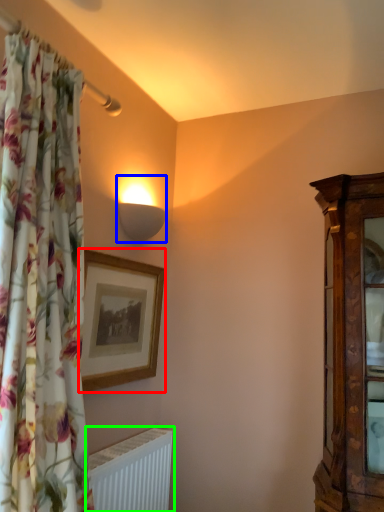
Question: Which is farther away from picture frame (highlighted by a red box)? lamp (highlighted by a blue box) or radiator (highlighted by a green box)?

Choices:
 (A) lamp
 (B) radiator

Answer: (B)